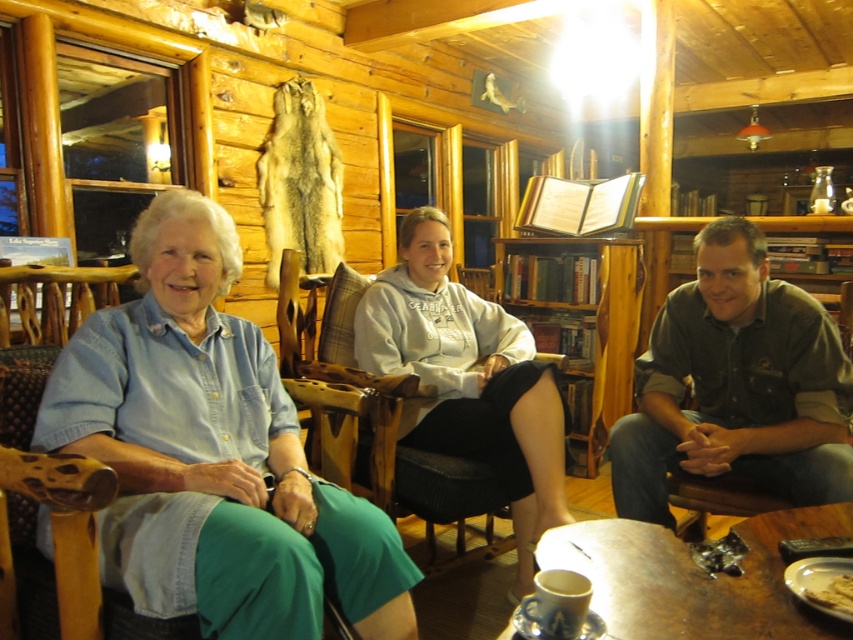
Question: Considering the relative positions of dark green shirt at center and wooden bookshelf at center in the image provided, where is dark green shirt at center located with respect to wooden bookshelf at center?

Choices:
 (A) right
 (B) left

Answer: (A)

Question: Considering the relative positions of denim shirt at left and gray fleece sweatshirt at center in the image provided, where is denim shirt at left located with respect to gray fleece sweatshirt at center?

Choices:
 (A) below
 (B) above

Answer: (B)

Question: Considering the relative positions of dark green shirt at center and golden crispy bread at lower right in the image provided, where is dark green shirt at center located with respect to golden crispy bread at lower right?

Choices:
 (A) left
 (B) right

Answer: (B)

Question: Estimate the real-world distances between objects in this image. Which object is farther from the gray fleece sweatshirt at center?

Choices:
 (A) golden crispy bread at lower right
 (B) wooden table at lower center
 (C) denim shirt at left
 (D) wooden bookshelf at center

Answer: (D)

Question: Estimate the real-world distances between objects in this image. Which object is closer to the dark green shirt at center?

Choices:
 (A) wooden table at lower center
 (B) golden crispy bread at lower right
 (C) gray fleece sweatshirt at center

Answer: (C)

Question: Among these points, which one is farthest from the camera?

Choices:
 (A) (848, 584)
 (B) (639, 316)
 (C) (498, 323)

Answer: (B)